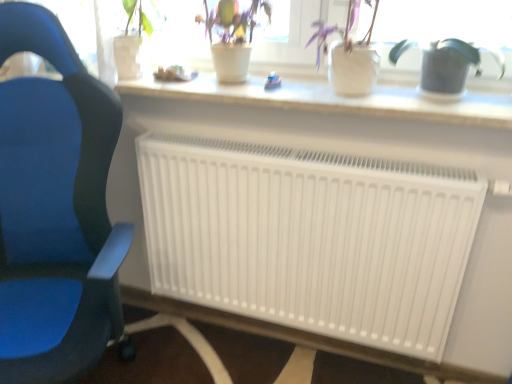
Locate an element on the screen. The height and width of the screenshot is (384, 512). green matte plant at upper center, the 3th houseplant from the right is located at coordinates (232, 37).

Where is `white matte radiator at center`? This screenshot has width=512, height=384. white matte radiator at center is located at coordinates (310, 237).

The image size is (512, 384). What are the coordinates of `blue fabric chair at left` in the screenshot? It's located at (55, 209).

Is green matte watering can at right, which is the 1th houseplant in right-to-left order, facing towards white matte pot at upper center, which appears as the second houseplant when viewed from the left?

No, green matte watering can at right, which is the 1th houseplant in right-to-left order, is not oriented towards white matte pot at upper center, which appears as the second houseplant when viewed from the left.

Is green matte watering can at right, which is the 1th houseplant in right-to-left order, beside white matte pot at upper center, the second houseplant viewed from the right?

No, green matte watering can at right, which is the 1th houseplant in right-to-left order, is not making contact with white matte pot at upper center, the second houseplant viewed from the right.

Is point (434, 60) behind point (360, 56)?

No, (434, 60) is in front of (360, 56).

Between green matte watering can at right, which is the 1th houseplant in right-to-left order, and white matte pot at upper center, which appears as the second houseplant when viewed from the left, which one has smaller size?

green matte watering can at right, which is the 1th houseplant in right-to-left order, is smaller.

Where is `the 3rd houseplant behind the blue fabric chair at left`? The image size is (512, 384). the 3rd houseplant behind the blue fabric chair at left is located at coordinates (232, 37).

Which is closer, (16, 201) or (234, 73)?

The point (16, 201) is in front.

From the image's perspective, would you say blue fabric chair at left is positioned over green matte plant at upper center, the 3th houseplant from the right?

Actually, blue fabric chair at left appears below green matte plant at upper center, the 3th houseplant from the right, in the image.

Considering the points (227, 11) and (386, 260), which point is in front, point (227, 11) or point (386, 260)?

The point (386, 260) is closer to the camera.

Is green matte plant at upper center, the 3th houseplant from the right, inside the boundaries of white matte radiator at center, or outside?

green matte plant at upper center, the 3th houseplant from the right, exists outside the volume of white matte radiator at center.

Which of these two, green matte plant at upper center, the 3th houseplant from the right, or white matte radiator at center, is bigger?

With larger size is white matte radiator at center.

You are a GUI agent. You are given a task and a screenshot of the screen. Output one action in this format:
    pyautogui.click(x=<x>, y=<y>)
    Task: Click on the radiator below the blue fabric chair at left (from a real-world perspective)
    This screenshot has height=384, width=512.
    Given the screenshot: What is the action you would take?
    (x=310, y=237)

From the picture: Which of these two, blue fabric chair at left or white matte radiator at center, stands shorter?

white matte radiator at center is shorter.

Does blue fabric chair at left have a smaller size compared to white matte radiator at center?

Actually, blue fabric chair at left might be larger than white matte radiator at center.

Does blue fabric chair at left have a lesser width compared to white matte radiator at center?

In fact, blue fabric chair at left might be wider than white matte radiator at center.

From a real-world perspective, is white matte radiator at center under green matte plant at upper center, which is the 1th houseplant from left to right?

Correct, in the physical world, white matte radiator at center is lower than green matte plant at upper center, which is the 1th houseplant from left to right.

From the picture: Is green matte plant at upper center, the 3th houseplant from the right, at the back of white matte radiator at center?

That's not correct — white matte radiator at center is not looking away from green matte plant at upper center, the 3th houseplant from the right.

From the picture: Is white matte radiator at center to the right of green matte plant at upper center, the 3th houseplant from the right, from the viewer's perspective?

Yes, white matte radiator at center is to the right of green matte plant at upper center, the 3th houseplant from the right.

Considering the sizes of white matte radiator at center and green matte plant at upper center, which is the 1th houseplant from left to right, in the image, is white matte radiator at center wider or thinner than green matte plant at upper center, which is the 1th houseplant from left to right,?

Clearly, white matte radiator at center has less width compared to green matte plant at upper center, which is the 1th houseplant from left to right.

Is blue fabric chair at left aimed at white matte pot at upper center, the second houseplant viewed from the right?

No, blue fabric chair at left is not turned towards white matte pot at upper center, the second houseplant viewed from the right.

From the image's perspective, between blue fabric chair at left and white matte pot at upper center, which appears as the second houseplant when viewed from the left, which one is located above?

white matte pot at upper center, which appears as the second houseplant when viewed from the left, appears higher in the image.

Looking at their sizes, would you say blue fabric chair at left is wider or thinner than white matte pot at upper center, the second houseplant viewed from the right?

blue fabric chair at left is wider than white matte pot at upper center, the second houseplant viewed from the right.

Which of these two, blue fabric chair at left or white matte pot at upper center, the second houseplant viewed from the right, is smaller?

Smaller between the two is white matte pot at upper center, the second houseplant viewed from the right.

Is white matte pot at upper center, the second houseplant viewed from the right, in front of or behind blue fabric chair at left in the image?

Visually, white matte pot at upper center, the second houseplant viewed from the right, is located behind blue fabric chair at left.

Where is `chair below the white matte pot at upper center, which appears as the second houseplant when viewed from the left (from the image's perspective)`? This screenshot has height=384, width=512. chair below the white matte pot at upper center, which appears as the second houseplant when viewed from the left (from the image's perspective) is located at coordinates (55, 209).

From their relative heights in the image, would you say white matte pot at upper center, the second houseplant viewed from the right, is taller or shorter than blue fabric chair at left?

white matte pot at upper center, the second houseplant viewed from the right, is shorter than blue fabric chair at left.

Is white matte pot at upper center, the second houseplant viewed from the right, not close to blue fabric chair at left?

No, white matte pot at upper center, the second houseplant viewed from the right, is not far away from blue fabric chair at left.

In order to click on houseplant below the white matte pot at upper center, the second houseplant viewed from the right (from the image's perspective) in this screenshot , I will do click(446, 65).

Locate an element on the screen. This screenshot has height=384, width=512. the 1st houseplant to the right of the blue fabric chair at left, starting your count from the anchor is located at coordinates (232, 37).

Based on the photo, when comparing their distances from white matte pot at upper center, the second houseplant viewed from the right, does blue fabric chair at left or green matte watering can at right, which is the third houseplant in left-to-right order, seem further?

blue fabric chair at left.

When comparing their distances from white matte pot at upper center, which appears as the second houseplant when viewed from the left, does green matte plant at upper center, which is the 1th houseplant from left to right, or white matte radiator at center seem closer?

green matte plant at upper center, which is the 1th houseplant from left to right.

Considering their positions, is green matte watering can at right, which is the third houseplant in left-to-right order, positioned further to white matte pot at upper center, which appears as the second houseplant when viewed from the left, than blue fabric chair at left?

blue fabric chair at left lies further to white matte pot at upper center, which appears as the second houseplant when viewed from the left, than the other object.

Which object lies nearer to the anchor point blue fabric chair at left, white matte radiator at center or green matte plant at upper center, the 3th houseplant from the right?

white matte radiator at center is closer to blue fabric chair at left.

Consider the image. Which object lies further to the anchor point green matte plant at upper center, which is the 1th houseplant from left to right, white matte radiator at center or blue fabric chair at left?

Based on the image, blue fabric chair at left appears to be further to green matte plant at upper center, which is the 1th houseplant from left to right.

Looking at the image, which one is located further to green matte plant at upper center, which is the 1th houseplant from left to right, blue fabric chair at left or green matte watering can at right, which is the third houseplant in left-to-right order?

Based on the image, blue fabric chair at left appears to be further to green matte plant at upper center, which is the 1th houseplant from left to right.

Based on their spatial positions, is green matte watering can at right, which is the 1th houseplant in right-to-left order, or green matte plant at upper center, which is the 1th houseplant from left to right, further from white matte radiator at center?

green matte watering can at right, which is the 1th houseplant in right-to-left order, lies further to white matte radiator at center than the other object.

From the image, which object appears to be farther from green matte watering can at right, which is the third houseplant in left-to-right order, white matte radiator at center or white matte pot at upper center, the second houseplant viewed from the right?

Based on the image, white matte radiator at center appears to be further to green matte watering can at right, which is the third houseplant in left-to-right order.

At what (x,y) coordinates should I click in order to perform the action: click on radiator located between blue fabric chair at left and green matte watering can at right, which is the 1th houseplant in right-to-left order, in the left-right direction. Please return your answer as a coordinate pair (x, y). The height and width of the screenshot is (384, 512). Looking at the image, I should click on (310, 237).

Identify the location of houseplant between white matte pot at upper center, which appears as the second houseplant when viewed from the left, and white matte radiator at center from top to bottom. (446, 65).

Identify the location of houseplant situated between blue fabric chair at left and white matte pot at upper center, the second houseplant viewed from the right, from left to right. [x=232, y=37].

Find the location of a particular element. This screenshot has height=384, width=512. houseplant located between blue fabric chair at left and white matte radiator at center in the left-right direction is located at coordinates (232, 37).